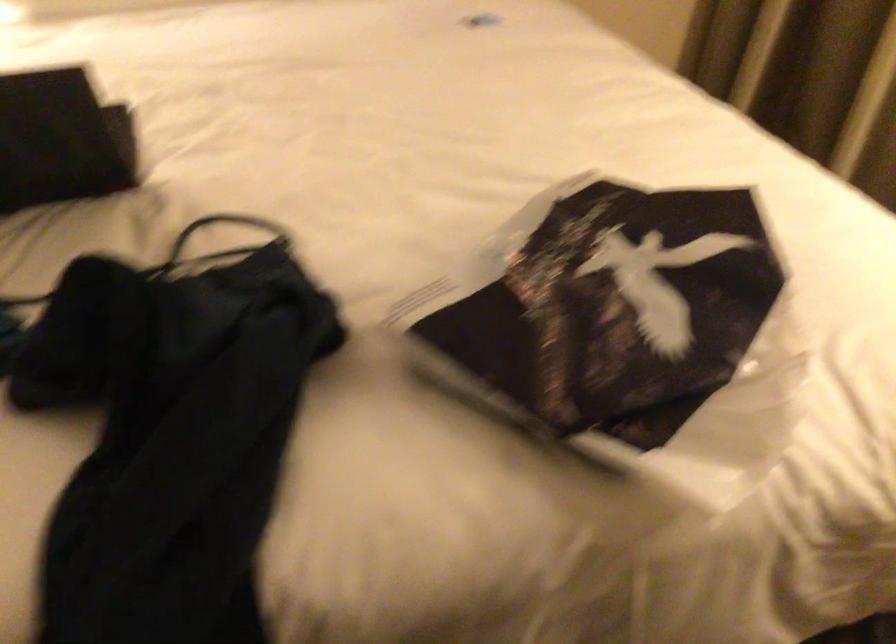
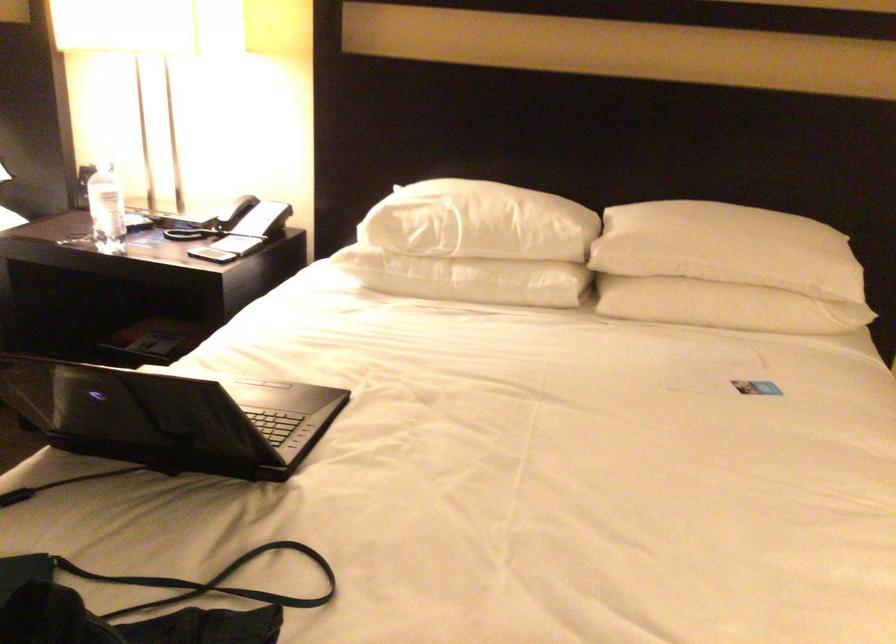
Question: I am providing you with two images of the same scene from different viewpoints. After the viewpoint changes to image2, which objects are now occluded?

Choices:
 (A) black bag strap
 (B) bottle cap
 (C) laptop lid
 (D) none of these

Answer: (D)